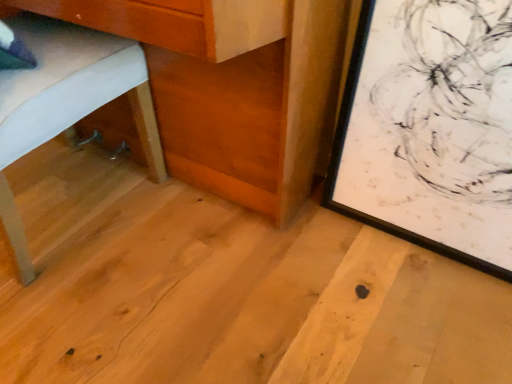
Question: Are matte white bed at left and natural wood table at lower left located far from each other?

Choices:
 (A) yes
 (B) no

Answer: (B)

Question: Does matte white bed at left turn towards natural wood table at lower left?

Choices:
 (A) no
 (B) yes

Answer: (B)

Question: Is matte white bed at left wider than natural wood table at lower left?

Choices:
 (A) no
 (B) yes

Answer: (B)

Question: Does matte white bed at left have a larger size compared to natural wood table at lower left?

Choices:
 (A) yes
 (B) no

Answer: (B)

Question: Is matte white bed at left completely or partially outside of natural wood table at lower left?

Choices:
 (A) yes
 (B) no

Answer: (B)

Question: Considering the relative sizes of matte white bed at left and natural wood table at lower left in the image provided, is matte white bed at left taller than natural wood table at lower left?

Choices:
 (A) yes
 (B) no

Answer: (B)

Question: Considering the relative sizes of natural wood table at lower left and black matte picture frame at lower right in the image provided, is natural wood table at lower left smaller than black matte picture frame at lower right?

Choices:
 (A) no
 (B) yes

Answer: (A)

Question: From the image's perspective, does natural wood table at lower left appear higher than black matte picture frame at lower right?

Choices:
 (A) no
 (B) yes

Answer: (B)

Question: From a real-world perspective, is natural wood table at lower left positioned over black matte picture frame at lower right based on gravity?

Choices:
 (A) no
 (B) yes

Answer: (B)

Question: Does natural wood table at lower left have a larger size compared to black matte picture frame at lower right?

Choices:
 (A) no
 (B) yes

Answer: (B)

Question: Considering the relative sizes of natural wood table at lower left and black matte picture frame at lower right in the image provided, is natural wood table at lower left thinner than black matte picture frame at lower right?

Choices:
 (A) yes
 (B) no

Answer: (B)

Question: Is natural wood table at lower left beside black matte picture frame at lower right?

Choices:
 (A) no
 (B) yes

Answer: (A)

Question: Is natural wood table at lower left positioned in front of matte white bed at left?

Choices:
 (A) yes
 (B) no

Answer: (B)